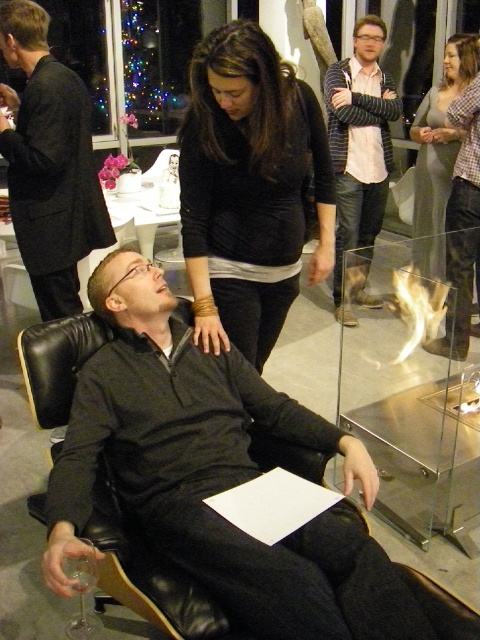
Can you confirm if striped sweater at center is positioned to the left of gray sweater at upper right?

Correct, you'll find striped sweater at center to the left of gray sweater at upper right.

Is point (372, 28) positioned after point (418, 108)?

No, it is not.

Find the location of `striped sweater at center`. striped sweater at center is located at coordinates (360, 152).

Consider the image. Between matte black sweater at center and striped sweater at center, which one appears on the right side from the viewer's perspective?

striped sweater at center is more to the right.

Between point (312, 438) and point (359, 132), which one is positioned in front?

Point (312, 438) is more forward.

Image resolution: width=480 pixels, height=640 pixels. In order to click on matte black sweater at center in this screenshot , I will do `click(214, 474)`.

Which of these two, transparent glass firebox at lower right or striped sweater at center, stands taller?

Standing taller between the two is striped sweater at center.

Is point (343, 413) positioned behind point (340, 232)?

No, (343, 413) is in front of (340, 232).

At what (x,y) coordinates should I click in order to perform the action: click on transparent glass firebox at lower right. Please return your answer as a coordinate pair (x, y). This screenshot has height=640, width=480. Looking at the image, I should click on (412, 397).